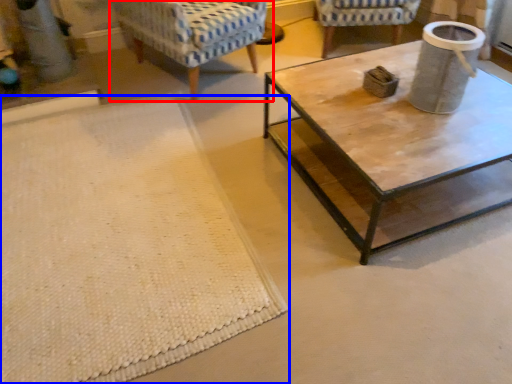
Question: Which point is closer to the camera, chair (highlighted by a red box) or mat (highlighted by a blue box)?

Choices:
 (A) chair
 (B) mat

Answer: (B)